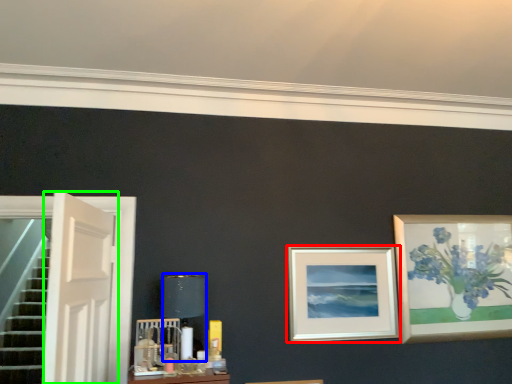
Question: Based on their relative distances, which object is farther from picture frame (highlighted by a red box)? Choose from table lamp (highlighted by a blue box) and door (highlighted by a green box).

Choices:
 (A) table lamp
 (B) door

Answer: (B)